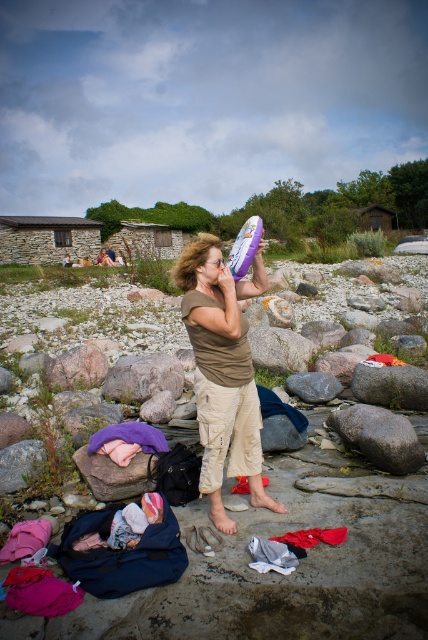
From the picture: Can you confirm if white cotton clothes at center is thinner than gray rock at center?

Yes.

Which is more to the right, white cotton clothes at center or gray rock at center?

Positioned to the right is white cotton clothes at center.

At what (x,y) coordinates should I click in order to perform the action: click on white cotton clothes at center. Please return your answer as a coordinate pair (x, y). The image size is (428, 640). Looking at the image, I should click on (290, 547).

Does gray rough rock at center have a smaller size compared to smooth gray rock at center-right?

Incorrect, gray rough rock at center is not smaller in size than smooth gray rock at center-right.

Which is more to the left, gray rough rock at center or smooth gray rock at center-right?

gray rough rock at center is more to the left.

Between point (169, 362) and point (412, 396), which one is positioned in front?

Point (412, 396) is more forward.

Where is `gray rough rock at center`? The image size is (428, 640). gray rough rock at center is located at coordinates tap(142, 378).

Does smooth gray rock at center-right come in front of gray smooth rock at center?

That is True.

Looking at this image, which is above, smooth gray rock at center-right or gray smooth rock at center?

smooth gray rock at center-right

Is point (357, 396) less distant than point (306, 388)?

That is True.

Where is `smooth gray rock at center-right`? The height and width of the screenshot is (640, 428). smooth gray rock at center-right is located at coordinates (391, 385).